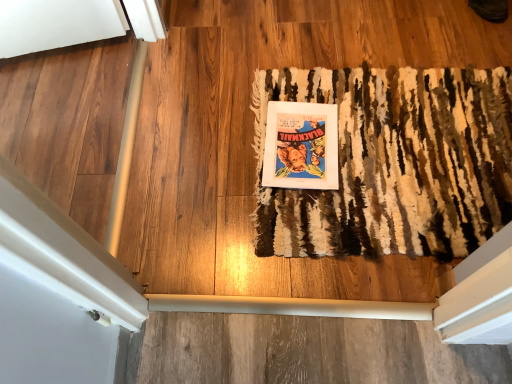
Locate an element on the screen. This screenshot has height=384, width=512. vacant region below rug at center (from a real-world perspective) is located at coordinates (369, 155).